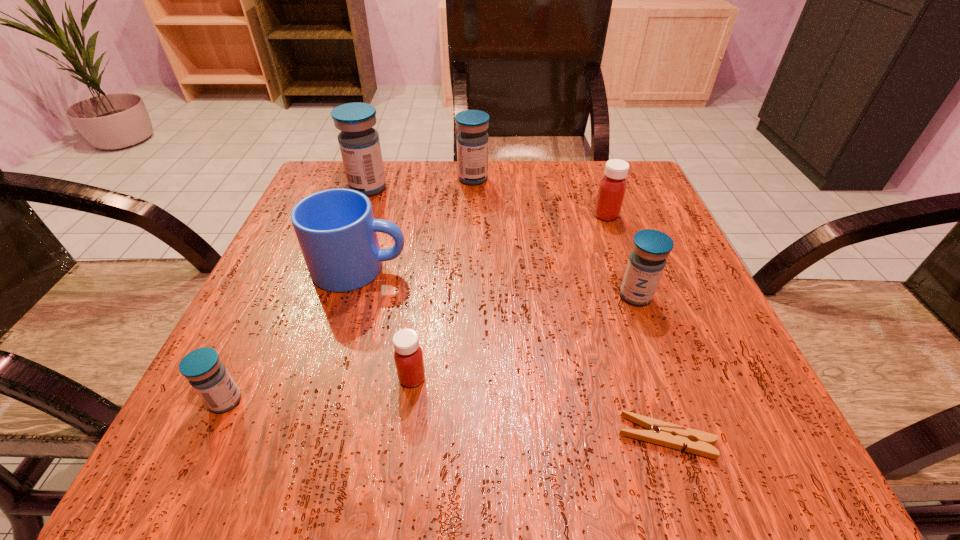
Identify which medicine is the closest to the right red medicine. Please provide its 2D coordinates. Your answer should be formatted as a tuple, i.e. [(x, y)], where the tuple contains the x and y coordinates of a point satisfying the conditions above.

[(646, 263)]

This screenshot has width=960, height=540. What are the coordinates of `medicine that is the second closest to the mug` in the screenshot? It's located at (359, 143).

At what (x,y) coordinates should I click in order to perform the action: click on the third closest blue medicine relative to the leftmost blue medicine. Please return your answer as a coordinate pair (x, y). Looking at the image, I should click on coord(472,141).

This screenshot has width=960, height=540. Identify the location of the closest blue medicine to the fifth object from left to right. (359, 143).

Identify the location of vacant space that satisfies the following two spatial constraints: 1. on the back side of the tallest object; 2. on the left side of the nearest blue medicine. The width and height of the screenshot is (960, 540). (326, 188).

You are a GUI agent. You are given a task and a screenshot of the screen. Output one action in this format:
    pyautogui.click(x=<x>, y=<y>)
    Task: Click on the free region that satisfies the following two spatial constraints: 1. on the back side of the shortest object; 2. on the side of the mug with the handle
    The image size is (960, 540).
    Given the screenshot: What is the action you would take?
    pyautogui.click(x=612, y=268)

You are a GUI agent. You are given a task and a screenshot of the screen. Output one action in this format:
    pyautogui.click(x=<x>, y=<y>)
    Task: Click on the vacant space that satisfies the following two spatial constraints: 1. on the front side of the second nearest blue medicine; 2. on the left side of the bigger red medicine
    The height and width of the screenshot is (540, 960).
    Given the screenshot: What is the action you would take?
    pyautogui.click(x=635, y=295)

At what (x,y) coordinates should I click in order to perform the action: click on vacant space that satisfies the following two spatial constraints: 1. on the side of the mug with the handle; 2. on the right side of the fourth medicine from right to left. Please return your answer as a coordinate pair (x, y). Image resolution: width=960 pixels, height=540 pixels. Looking at the image, I should click on (328, 378).

Locate an element on the screen. This screenshot has width=960, height=540. free space that satisfies the following two spatial constraints: 1. on the back side of the second blue medicine from right to left; 2. on the right side of the leftmost medicine is located at coordinates (331, 179).